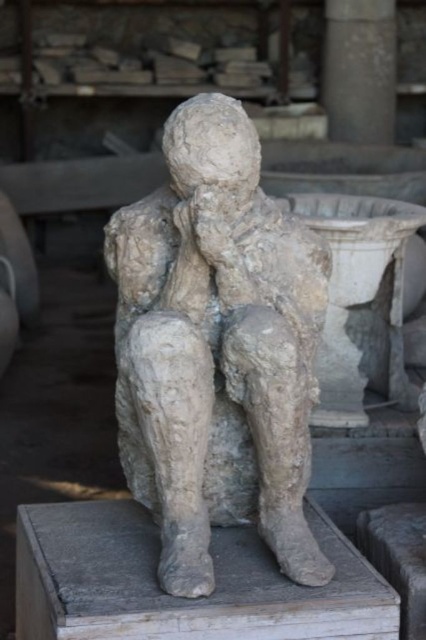
Question: Which point is farther to the camera?

Choices:
 (A) gray stone statue at center
 (B) smooth gray stone pillar at upper center

Answer: (B)

Question: Which of the following is the closest to the observer?

Choices:
 (A) smooth gray stone pillar at upper center
 (B) gray stone statue at center

Answer: (B)

Question: Is gray stone statue at center above smooth gray stone pillar at upper center?

Choices:
 (A) yes
 (B) no

Answer: (B)

Question: Is gray stone statue at center to the left of smooth gray stone pillar at upper center from the viewer's perspective?

Choices:
 (A) no
 (B) yes

Answer: (B)

Question: Does gray stone statue at center come behind smooth gray stone pillar at upper center?

Choices:
 (A) yes
 (B) no

Answer: (B)